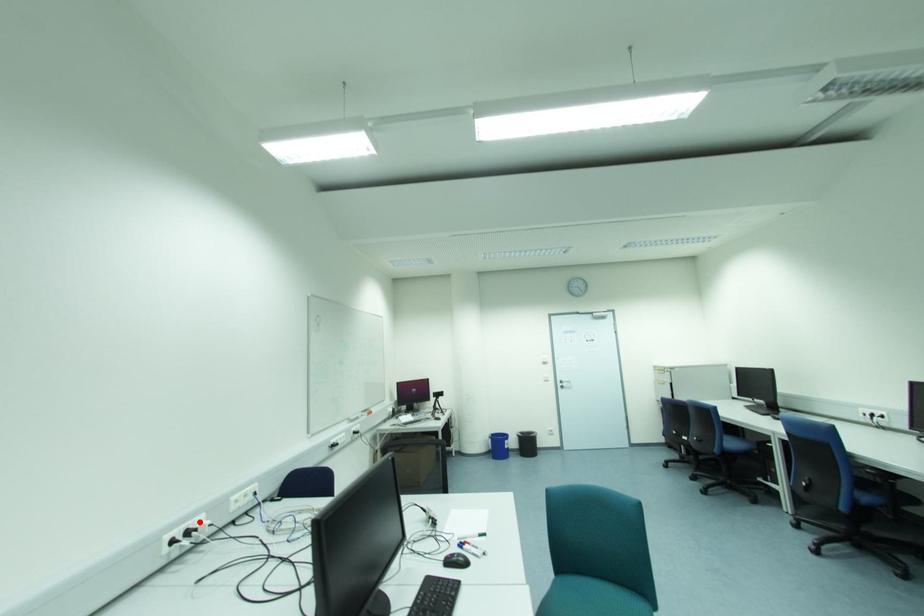
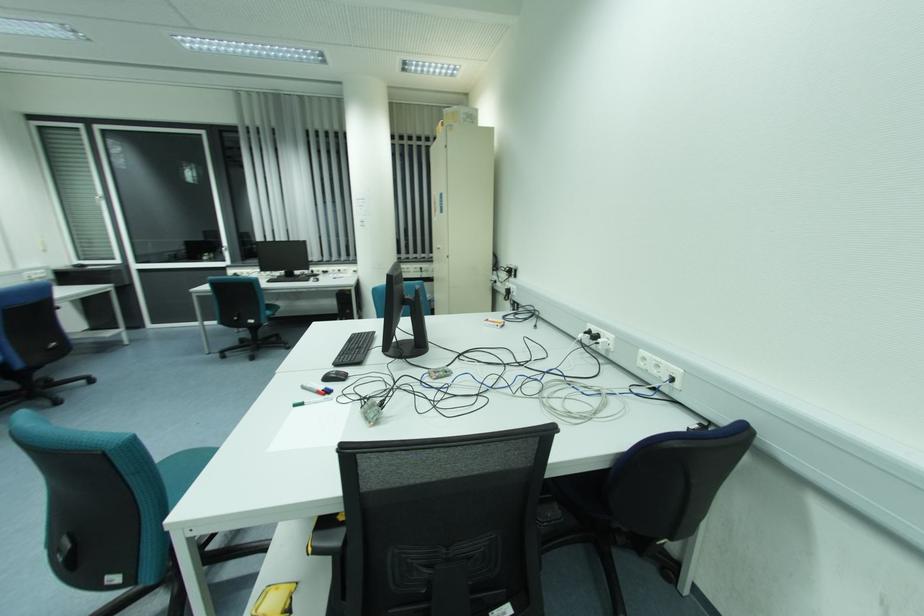
Where in the second image is the point corresponding to the highlighted location from the first image?

(608, 339)